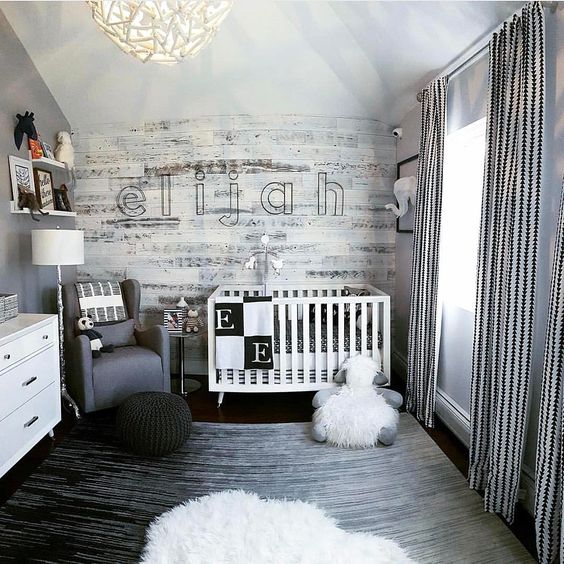
The width and height of the screenshot is (564, 564). Identify the location of chandelier. (166, 39).